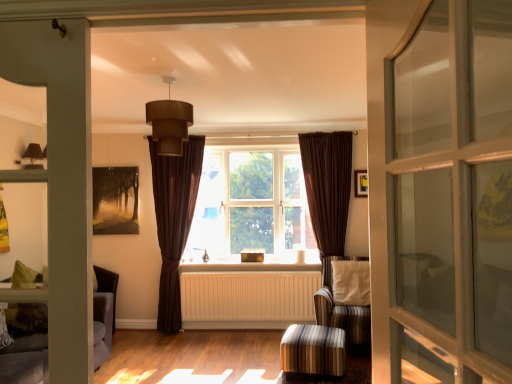
I want to click on blank space situated above brown velvet curtain at center, marked as the second curtain in a left-to-right arrangement (from a real-world perspective), so click(326, 131).